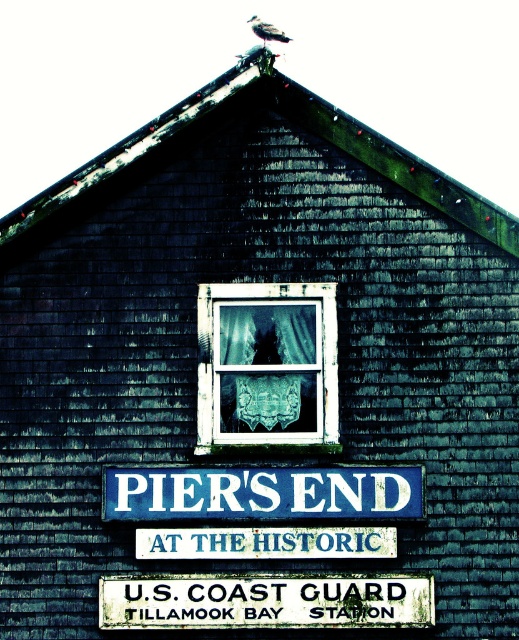
You are standing in front of the weathered wooden building and want to place a small decorative item at the bottom of the white painted wood located at point (265, 602). Is there enough space to place it there?

The point (265, 602) is at the bottom of the white painted wood, so there is enough space to place the item there.

You are standing in front of the wooden building and want to locate the white painted wood at bottom. Where should you look?

The white painted wood at bottom is located at point (265, 602).